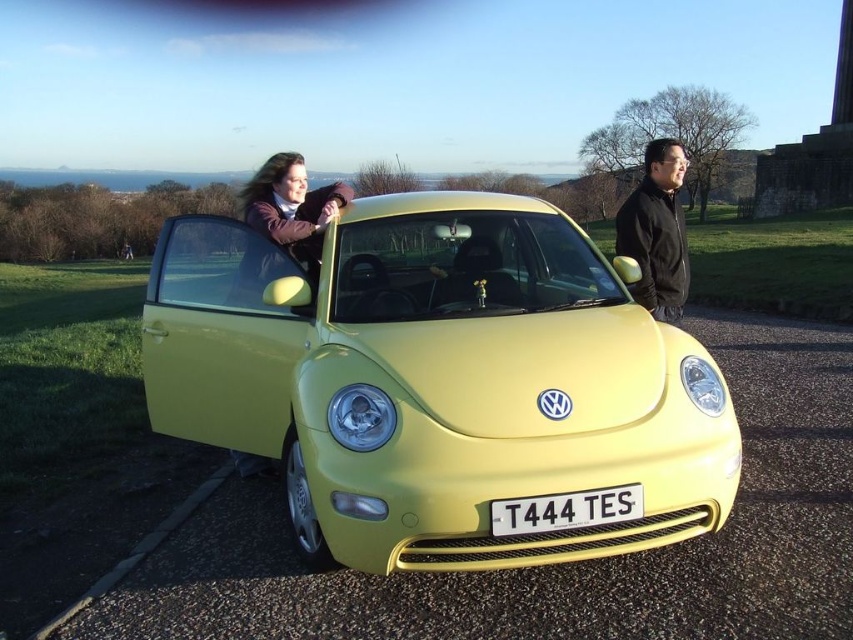
You are a pedestrian standing at the edge of the paved area. You see the lime matte car at center and the black matte jacket at right. Which object is closer to the ground?

The lime matte car at center is closer to the ground because it is located below the black matte jacket at right.